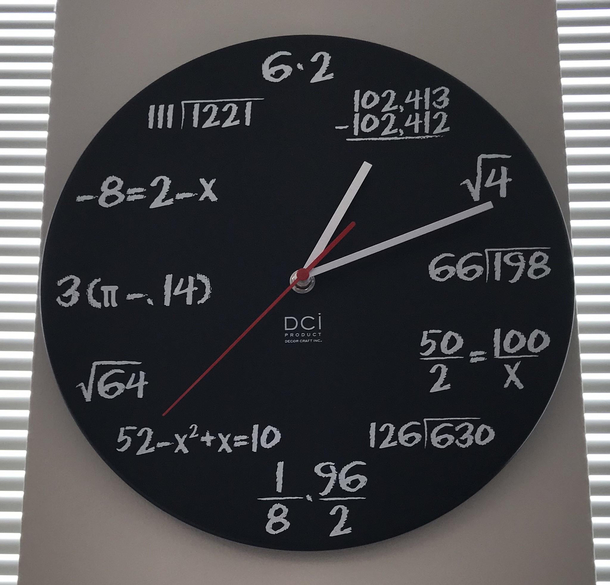
The image size is (610, 585). I want to click on hour hand on  clock, so click(362, 172).